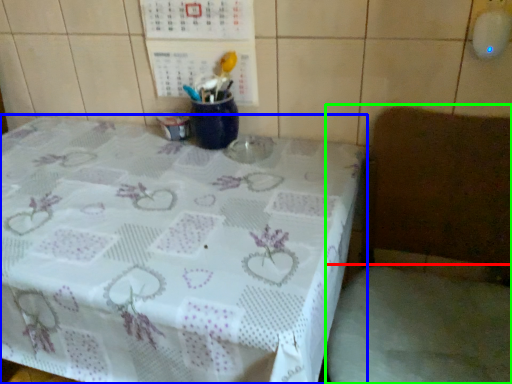
Question: Which object is the closest to the fabric (highlighted by a red box)? Choose among these: table (highlighted by a blue box) or chair (highlighted by a green box).

Choices:
 (A) table
 (B) chair

Answer: (B)